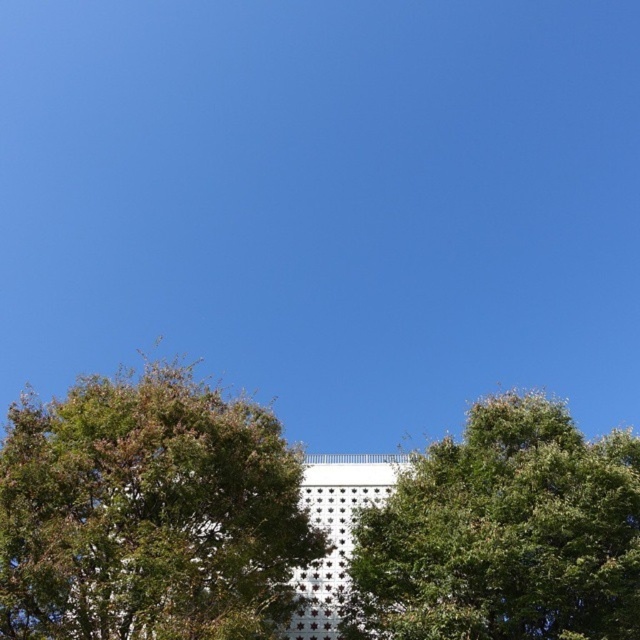
Question: Which point appears farthest from the camera in this image?

Choices:
 (A) (282, 515)
 (B) (550, 516)

Answer: (A)

Question: Does green leafy tree at center have a greater width compared to green leafy tree at upper center?

Choices:
 (A) no
 (B) yes

Answer: (B)

Question: Is green leafy tree at center wider than green leafy tree at upper center?

Choices:
 (A) no
 (B) yes

Answer: (B)

Question: Is green leafy tree at center bigger than green leafy tree at upper center?

Choices:
 (A) no
 (B) yes

Answer: (B)